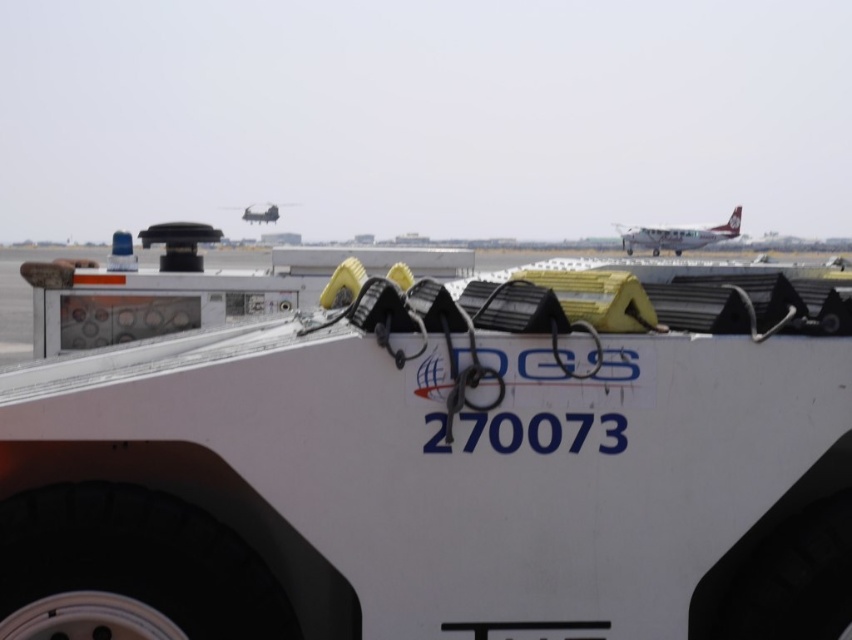
Looking at this image, you are a pilot preparing for takeoff and you see the white matte airplane at upper right and the metallic silver airplane at upper center. Which airplane is positioned lower in the sky?

The white matte airplane at upper right is positioned lower than the metallic silver airplane at upper center because it is described as being below it.

You are a ground crew member at the airport. You need to determine which airplane, the white matte airplane at upper right or the metallic silver airplane at upper center, requires more space for parking. Based on the scene, which one would need a larger area?

The white matte airplane at upper right is bigger than the metallic silver airplane at upper center, so it would require more space for parking.

You are standing at the point labeled as point (430, 454) in the image. What object are you facing?

The point (430, 454) corresponds to the white matte trailer truck at center, so you are facing the white matte trailer truck at center.